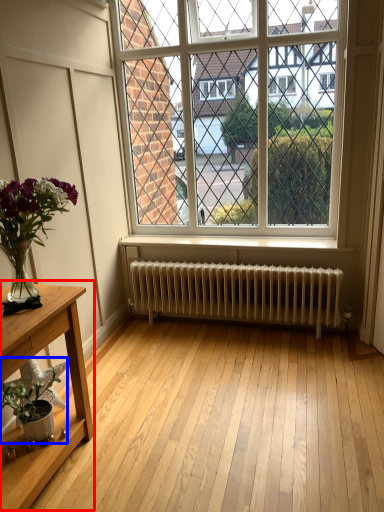
Question: Which of the following is the closest to the observer, table (highlighted by a red box) or houseplant (highlighted by a blue box)?

Choices:
 (A) table
 (B) houseplant

Answer: (A)